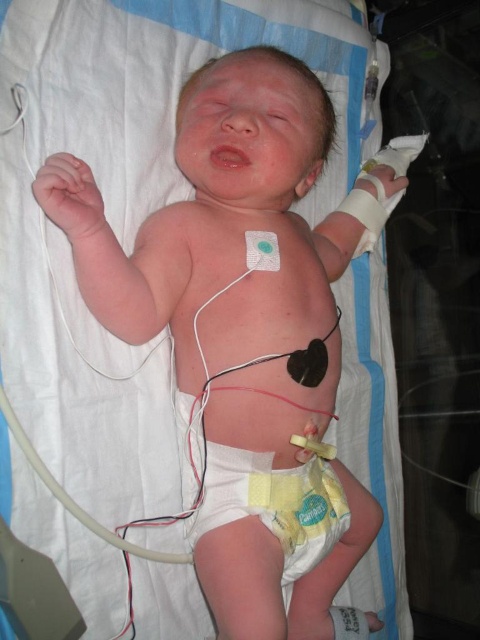
You are a nurse in a hospital nursery. You see the yellow cloth diaper at center and the rubber teething ring at upper left. Which item is positioned to the right of the other?

The yellow cloth diaper at center is to the right of the rubber teething ring at upper left.

You are a healthcare professional holding a medical tool that has a 30 inch reach. You need to reach the point at coordinates point (218, 460) in the image. Can you reach it with your current tool?

The point at coordinates point (218, 460) is 34.18 inches away from the camera. Since the tool only has a 30 inch reach, you cannot reach it with your current tool.

You are a nurse in the hospital room and need to check the wires connected to the newborn baby. There are two points marked on the bed where the wires are attached. One is at point (300, 499) and the other at point (75, 166). Which point is closer to the baby?

Point (75, 166) is closer to the baby because it is in front of point (300, 499), which is behind it.